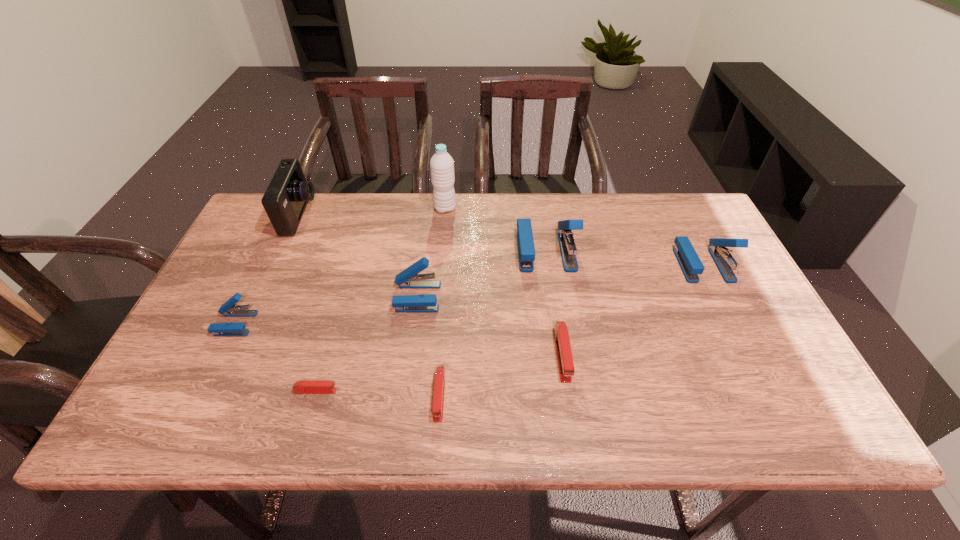
This screenshot has height=540, width=960. Identify the location of water bottle. (441, 164).

Locate an element on the screen. Image resolution: width=960 pixels, height=540 pixels. the tallest object is located at coordinates (441, 164).

Identify the location of camera. The width and height of the screenshot is (960, 540). (285, 199).

The height and width of the screenshot is (540, 960). In order to click on the tallest stapler in this screenshot , I will do `click(526, 251)`.

At what (x,y) coordinates should I click in order to perform the action: click on the biggest blue stapler. Please return your answer as a coordinate pair (x, y). The height and width of the screenshot is (540, 960). Looking at the image, I should click on (526, 251).

At what (x,y) coordinates should I click in order to perform the action: click on the second biggest blue stapler. Please return your answer as a coordinate pair (x, y). The width and height of the screenshot is (960, 540). Looking at the image, I should click on (689, 261).

The image size is (960, 540). I want to click on the rightmost blue stapler, so click(689, 261).

Locate an element on the screen. This screenshot has height=540, width=960. the third biggest blue stapler is located at coordinates (409, 278).

Where is `the fifth shortest stapler`? Image resolution: width=960 pixels, height=540 pixels. the fifth shortest stapler is located at coordinates (409, 278).

This screenshot has height=540, width=960. What are the coordinates of `the smallest blue stapler` in the screenshot? It's located at (228, 309).